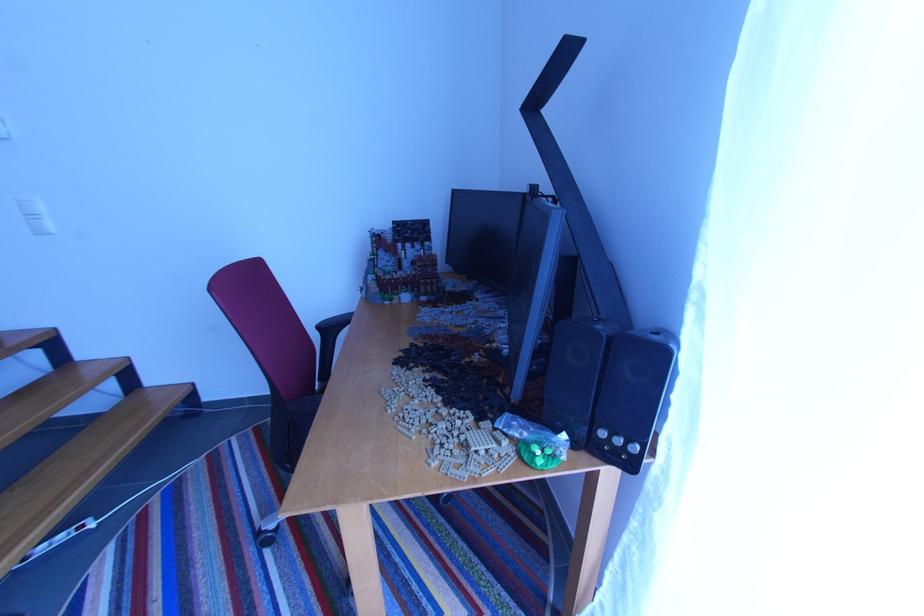
I want to click on silver speaker dial, so [x=623, y=459].